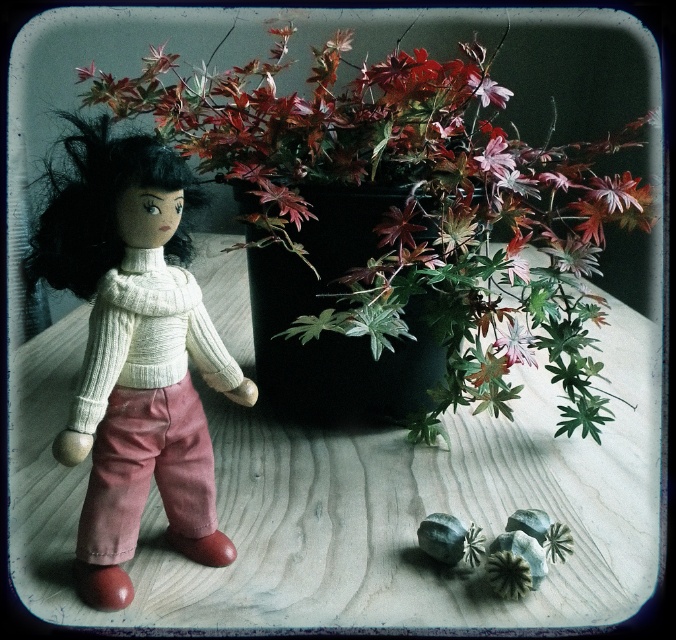
Between silvery metallic flower at center and matte pink petal at upper center, which one appears on the left side from the viewer's perspective?

Positioned to the left is matte pink petal at upper center.

Is silvery metallic flower at center thinner than matte pink petal at upper center?

Yes, silvery metallic flower at center is thinner than matte pink petal at upper center.

Is point (523, 349) more distant than point (500, 161)?

Yes.

You are a GUI agent. You are given a task and a screenshot of the screen. Output one action in this format:
    pyautogui.click(x=<x>, y=<y>)
    Task: Click on the silvery metallic flower at center
    
    Given the screenshot: What is the action you would take?
    pyautogui.click(x=514, y=342)

In the scene shown: Can you confirm if leaves matte/black at left is wider than white knitted sweater at left?

Yes, leaves matte/black at left is wider than white knitted sweater at left.

Can you confirm if leaves matte/black at left is positioned to the left of white knitted sweater at left?

Incorrect, leaves matte/black at left is not on the left side of white knitted sweater at left.

Who is more distant from viewer, (272,221) or (220,353)?

Positioned behind is point (272,221).

This screenshot has width=676, height=640. Identify the location of leaves matte/black at left. (410, 204).

Can you confirm if leaves matte/black at left is shorter than matte white sweater at center?

Incorrect, leaves matte/black at left's height does not fall short of matte white sweater at center's.

Who is more forward, (510, 141) or (162, 460)?

Point (162, 460)

This screenshot has width=676, height=640. I want to click on leaves matte/black at left, so click(x=410, y=204).